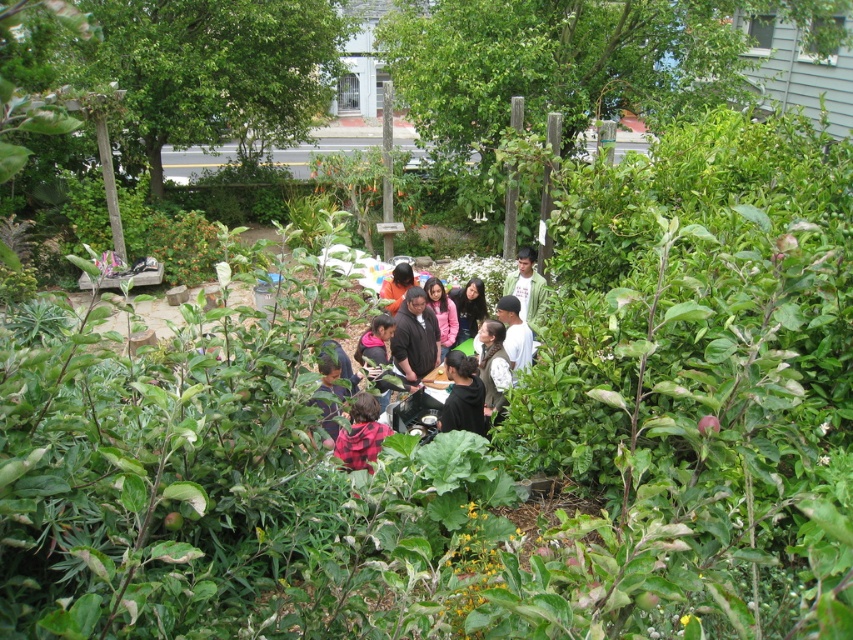
You are a photographer at the community garden event and want to capture a photo of the dark brown jacket at center and the white matte shirt at center. Based on their positions, which one is closer to the camera?

The dark brown jacket at center is above the white matte shirt at center, so it is closer to the camera.